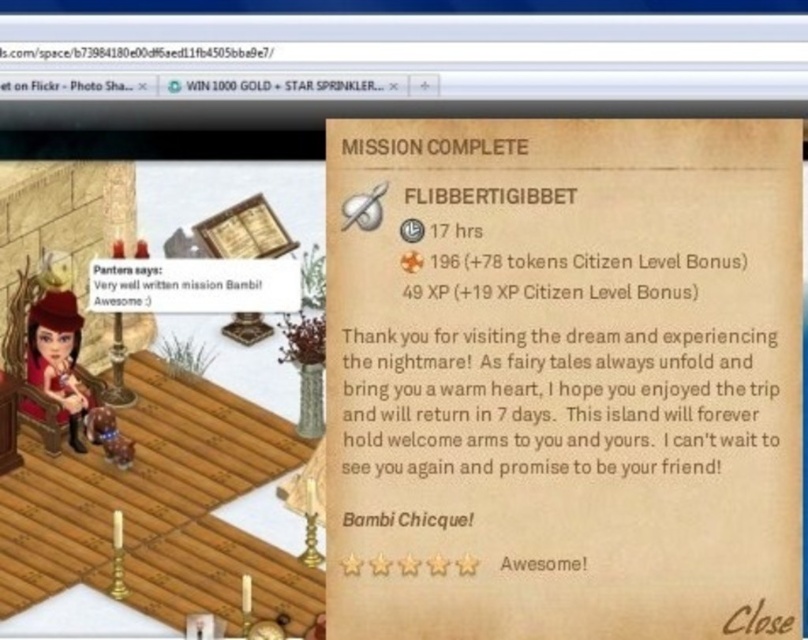
Who is shorter, white paper at upper center or brown paper text at upper center?

With less height is white paper at upper center.

Can you confirm if white paper at upper center is positioned to the left of brown paper text at upper center?

Correct, you'll find white paper at upper center to the left of brown paper text at upper center.

Which is in front, point (0, 56) or point (448, 144)?

Positioned in front is point (0, 56).

Where is `white paper at upper center`? Image resolution: width=808 pixels, height=640 pixels. white paper at upper center is located at coordinates (133, 51).

Does point (141, 292) come behind point (11, 44)?

Yes, point (141, 292) is behind point (11, 44).

Identify the location of white paper text at upper left. (183, 285).

Looking at this image, is white paper text at upper left to the left of brown paper text at upper center from the viewer's perspective?

Yes, white paper text at upper left is to the left of brown paper text at upper center.

Is the position of white paper text at upper left less distant than that of brown paper text at upper center?

No, it is behind brown paper text at upper center.

Where is `white paper text at upper left`? This screenshot has width=808, height=640. white paper text at upper left is located at coordinates (183, 285).